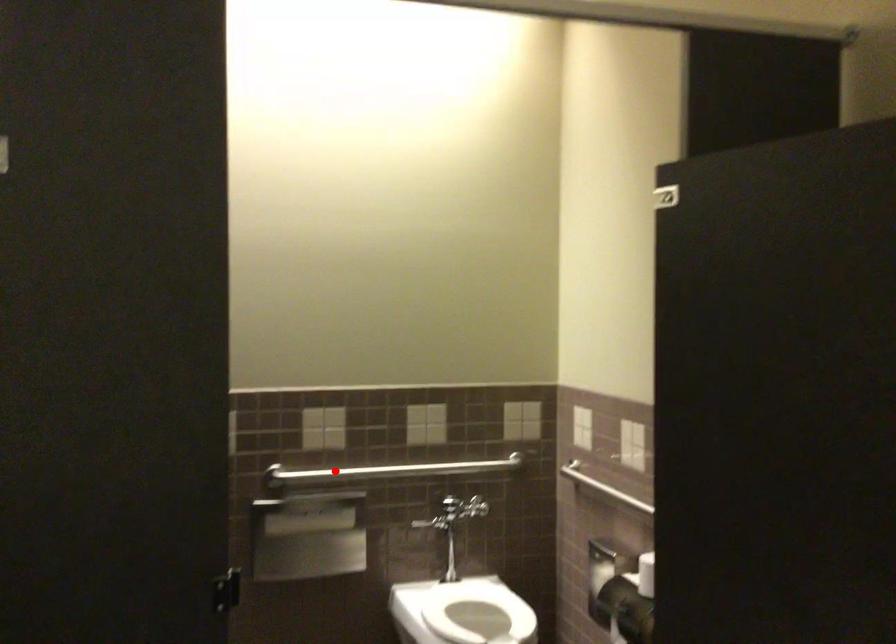
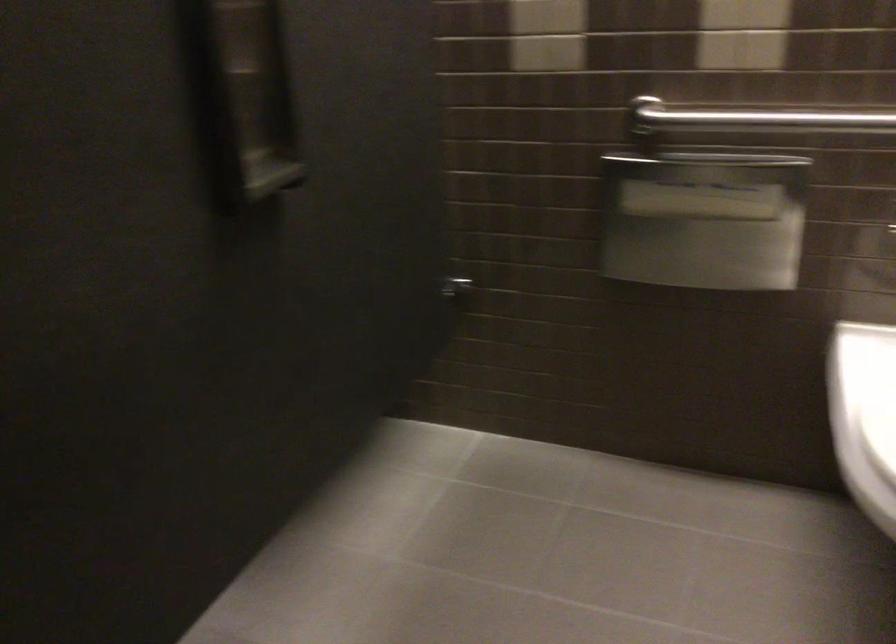
Question: I am providing you with two images of the same scene from different viewpoints. Given a red point in image1, look at the same physical point in image2. Is it:

Choices:
 (A) Closer to the viewpoint
 (B) Farther from the viewpoint

Answer: (A)